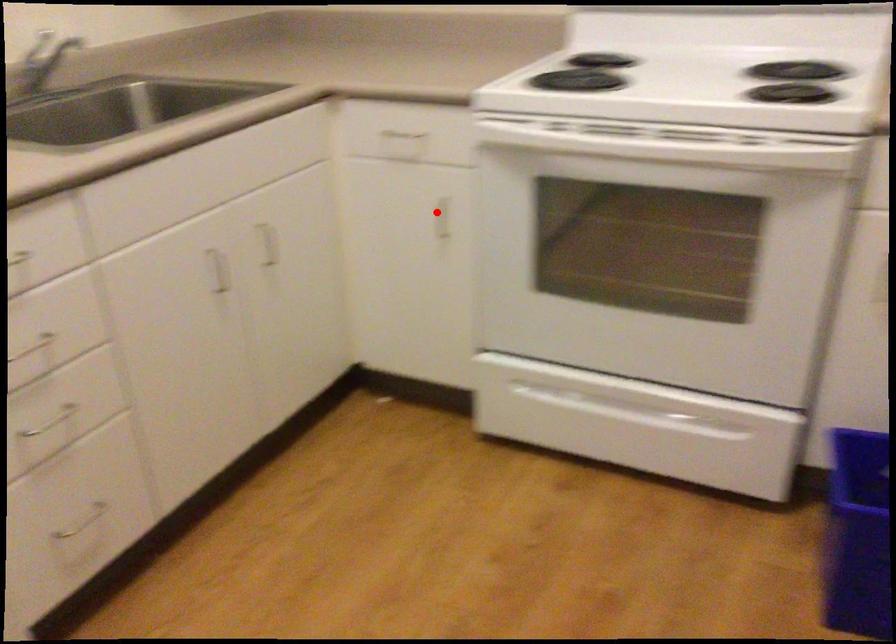
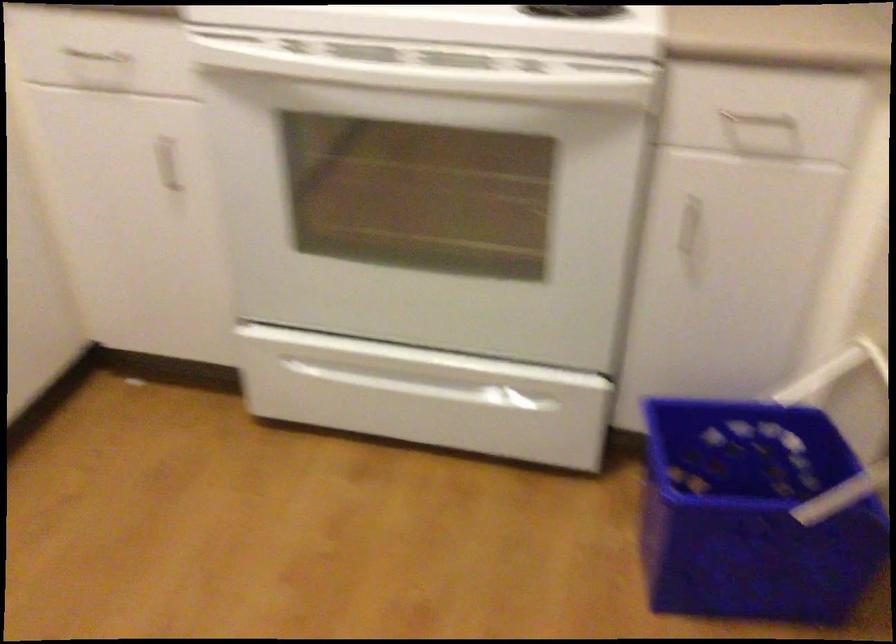
Question: A red point is marked in image1. In image2, is the corresponding 3D point closer to the camera or farther? Reply with the corresponding letter.

Choices:
 (A) The corresponding 3D point is closer.
 (B) The corresponding 3D point is farther.

Answer: (A)